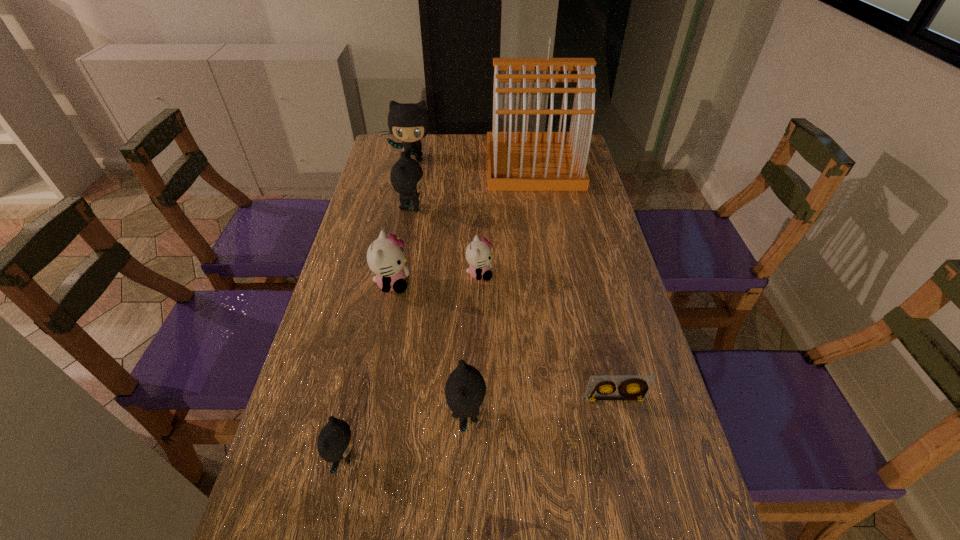
This screenshot has height=540, width=960. Identify the location of the tallest object. (516, 161).

Where is `birdcage`? birdcage is located at coordinates (516, 161).

The height and width of the screenshot is (540, 960). In order to click on the farthest kitten in this screenshot , I will do 408,122.

Where is `the farthest gray kitten`? This screenshot has height=540, width=960. the farthest gray kitten is located at coordinates (408, 122).

At what (x,y) coordinates should I click in order to perform the action: click on the second farthest gray kitten. Please return your answer as a coordinate pair (x, y). Looking at the image, I should click on (406, 176).

Identify the location of the third smallest gray kitten. This screenshot has height=540, width=960. (406, 176).

Where is `the bigger white kitten`? the bigger white kitten is located at coordinates (385, 258).

The image size is (960, 540). Identify the location of the rightmost gray kitten. (465, 391).

You are a GUI agent. You are given a task and a screenshot of the screen. Output one action in this format:
    pyautogui.click(x=<x>, y=<y>)
    Task: Click on the smaller white kitten
    This screenshot has width=960, height=540.
    Given the screenshot: What is the action you would take?
    pyautogui.click(x=478, y=255)

Locate an element on the screen. The width and height of the screenshot is (960, 540). the smallest gray kitten is located at coordinates (334, 443).